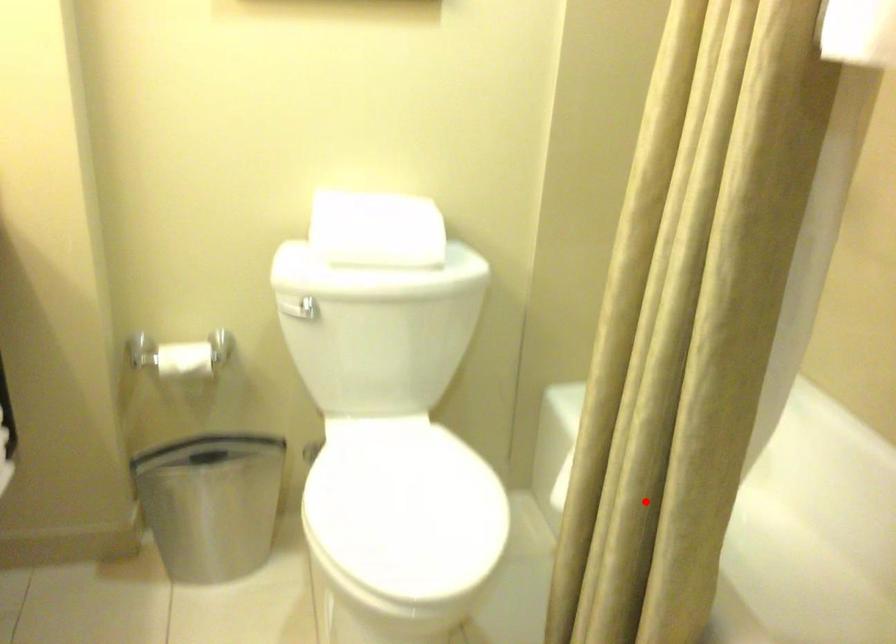
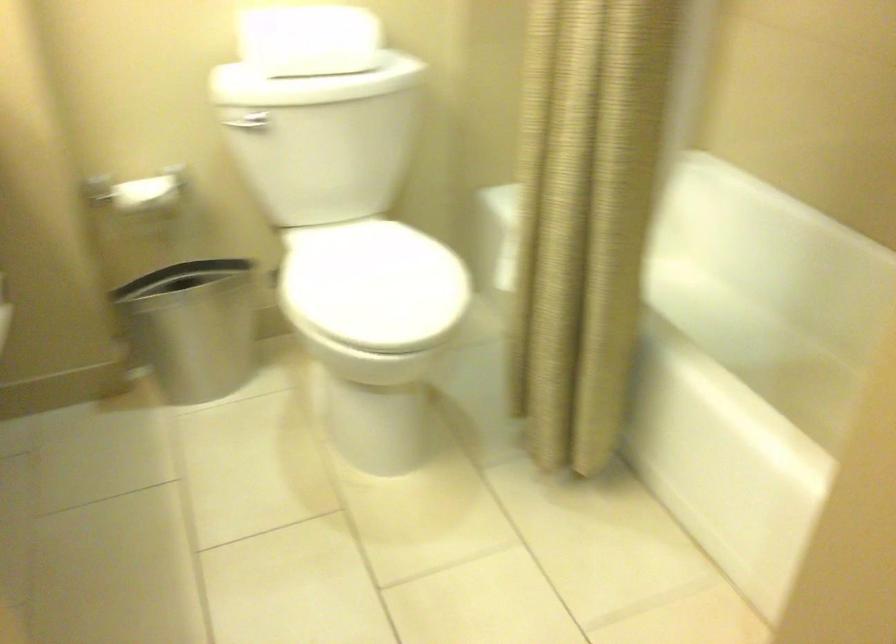
Question: I am providing you with two images of the same scene from different viewpoints. A red point is shown in image1. For the corresponding object point in image2, is it positioned nearer or farther from the camera?

Choices:
 (A) Nearer
 (B) Farther

Answer: (B)